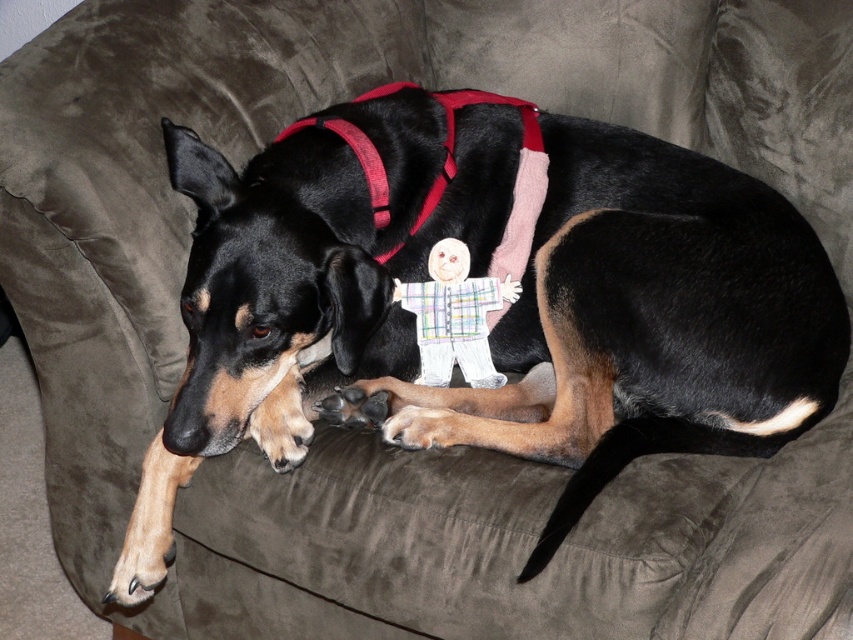
Question: Among these objects, which one is farthest from the camera?

Choices:
 (A) plaid fabric doll at center
 (B) black smooth dog at center

Answer: (A)

Question: In this image, where is black smooth dog at center located relative to plaid fabric doll at center?

Choices:
 (A) below
 (B) above

Answer: (B)

Question: Which object appears farthest from the camera in this image?

Choices:
 (A) plaid fabric doll at center
 (B) black smooth dog at center

Answer: (A)

Question: Does black smooth dog at center appear on the right side of plaid fabric doll at center?

Choices:
 (A) no
 (B) yes

Answer: (A)

Question: Is black smooth dog at center wider than plaid fabric doll at center?

Choices:
 (A) no
 (B) yes

Answer: (B)